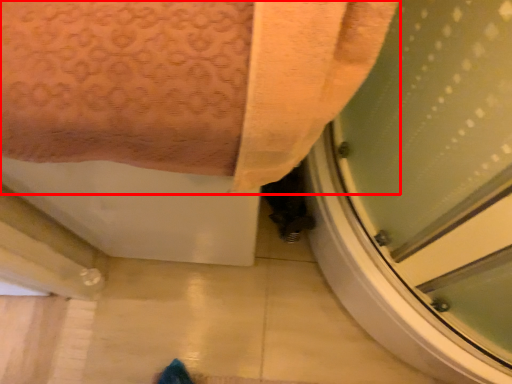
Question: From the image's perspective, what is the correct spatial positioning of towel (annotated by the red box) in reference to screen door?

Choices:
 (A) above
 (B) below

Answer: (A)